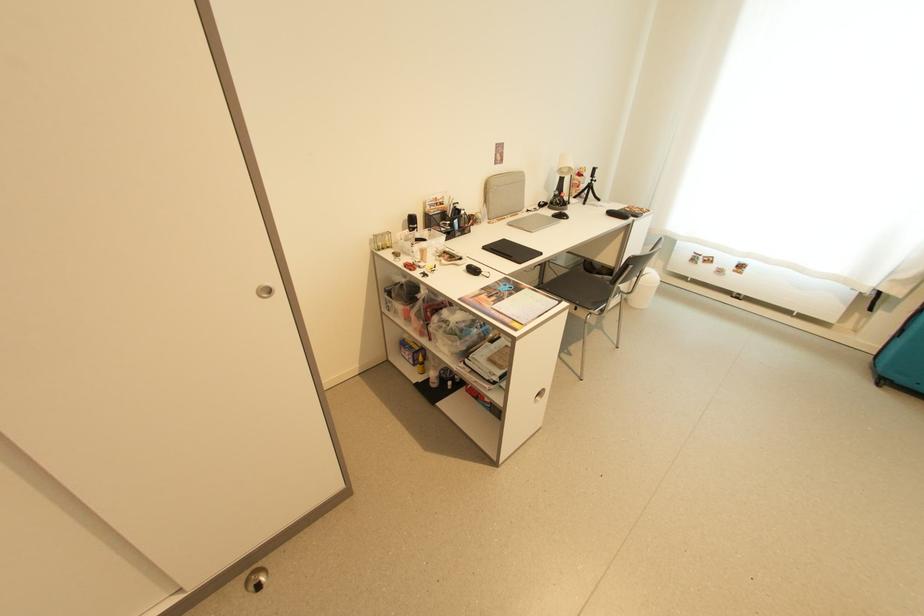
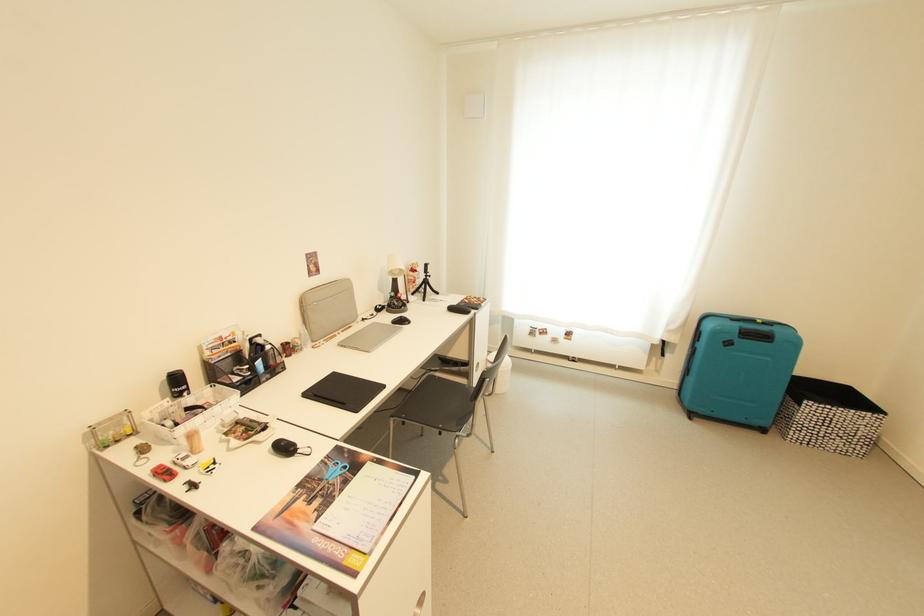
Question: The camera is either moving clockwise (left) or counter-clockwise (right) around the object. The first image is from the beginning of the video and the second image is from the end. Is the camera moving left or right when shooting the video?

Choices:
 (A) Left
 (B) Right

Answer: (A)